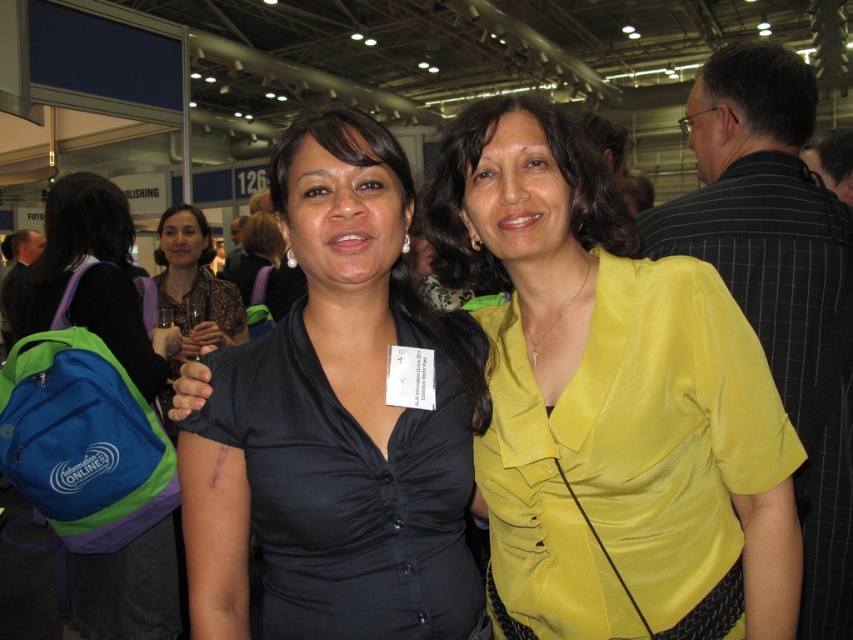
You are organizing a fashion show and need to arrange two blouses on a mannequin. The black satin blouse at center and the matte black blouse at center. Which one should you place on top to create a layered look?

The black satin blouse at center has a greater height compared to the matte black blouse at center, so placing it on top would create a layered look.

You are a photographer at the event and need to take a photo of the blue fabric backpack at left. Your camera is 2 meters away from the backpack. Can you capture the entire backpack in your shot without moving the camera?

The blue fabric backpack at left and camera are 2.00 meters apart from each other. To capture the entire backpack without moving the camera, ensure your camera has a wide enough lens or adjust your position slightly if possible.